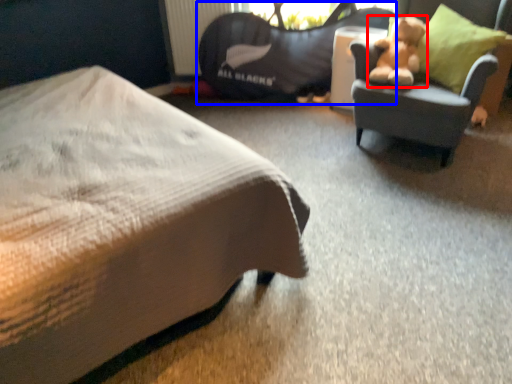
Question: Which of the following is the farthest to the observer, teddy bear (highlighted by a red box) or bean bag chair (highlighted by a blue box)?

Choices:
 (A) teddy bear
 (B) bean bag chair

Answer: (B)